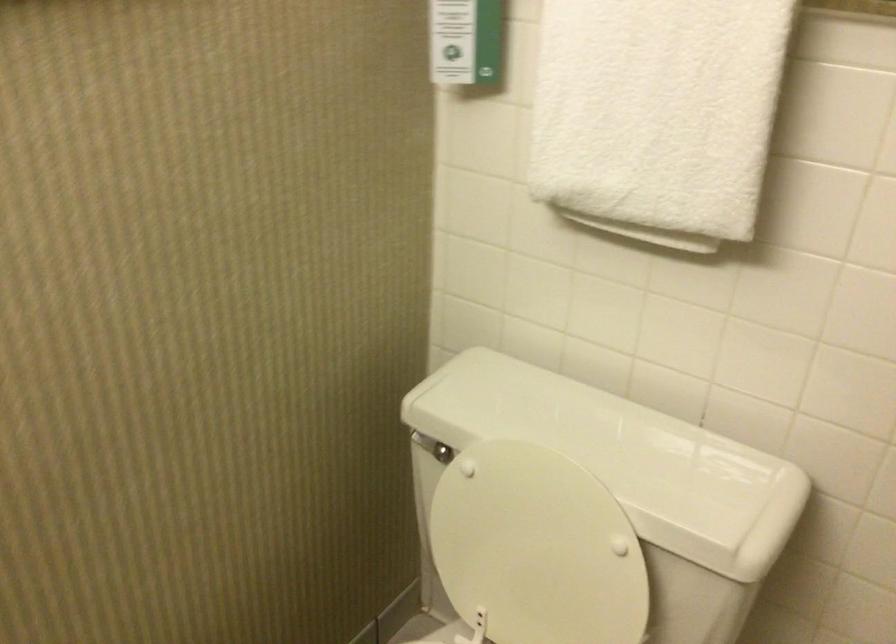
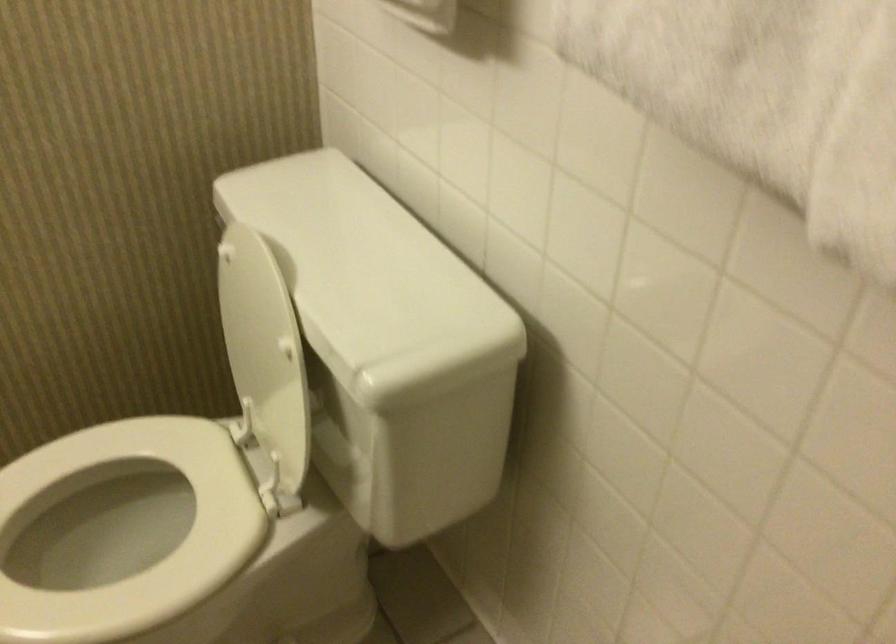
Question: Which direction would the cameraman need to move to produce the second image? Reply with the corresponding letter.

Choices:
 (A) Left
 (B) Right
 (C) Forward
 (D) Backward

Answer: (B)